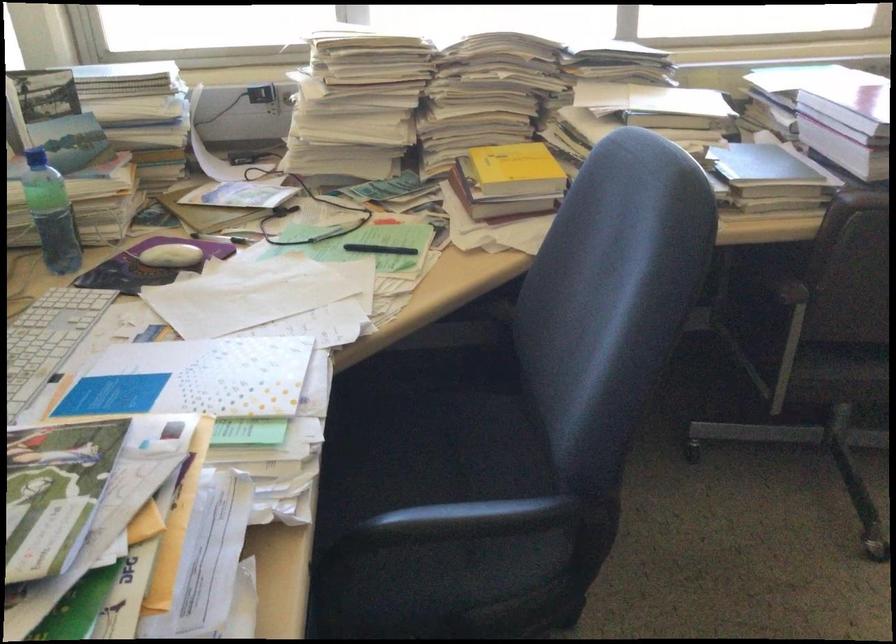
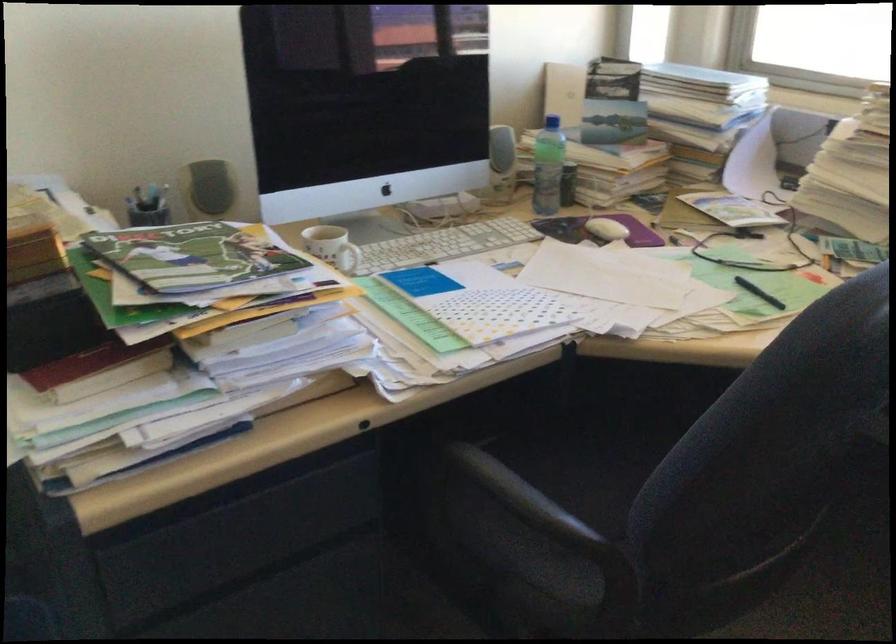
Find the pixel in the second image that matches the point at 383,249 in the first image.

(759, 292)